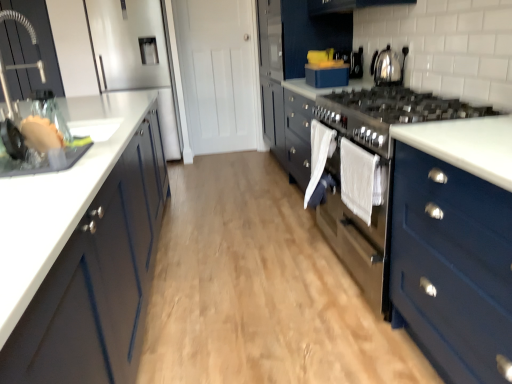
Question: Considering their positions, is matte blue dresser at center located in front of or behind wooden floor at center?

Choices:
 (A) behind
 (B) front

Answer: (A)

Question: Is matte blue dresser at center to the left or to the right of wooden floor at center in the image?

Choices:
 (A) left
 (B) right

Answer: (B)

Question: Which is nearer to the matte blue dresser at center?

Choices:
 (A) blue matte box at upper center
 (B) blue matte cabinet at lower right, which is the 1th cabinetry in right-to-left order
 (C) white matte cabinet at left, the third cabinetry viewed from the right
 (D) shiny metallic kettle at upper right
 (E) white fabric towel at center, which is the 2th clothe in front-to-back order

Answer: (B)

Question: Estimate the real-world distances between objects in this image. Which object is farther from the blue matte cabinet at lower right, which ranks as the third cabinetry in left-to-right order?

Choices:
 (A) white matte cabinet at left, which is the first cabinetry in left-to-right order
 (B) white cotton towel at center, marked as the 2th clothe in a back-to-front arrangement
 (C) blue matte box at upper center
 (D) brushed metal faucet at left, which is the 2th cabinetry from left to right
 (E) white fabric towel at center, which is the 2th clothe in front-to-back order

Answer: (D)